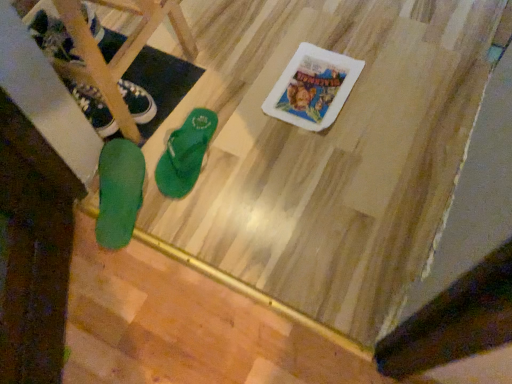
Where is `vacant space in between green rubber flip-flop at lower left, the second footwear when ordered from right to left, and green rubber flip-flop at center, the third footwear from the left`? Image resolution: width=512 pixels, height=384 pixels. vacant space in between green rubber flip-flop at lower left, the second footwear when ordered from right to left, and green rubber flip-flop at center, the third footwear from the left is located at coordinates tap(159, 165).